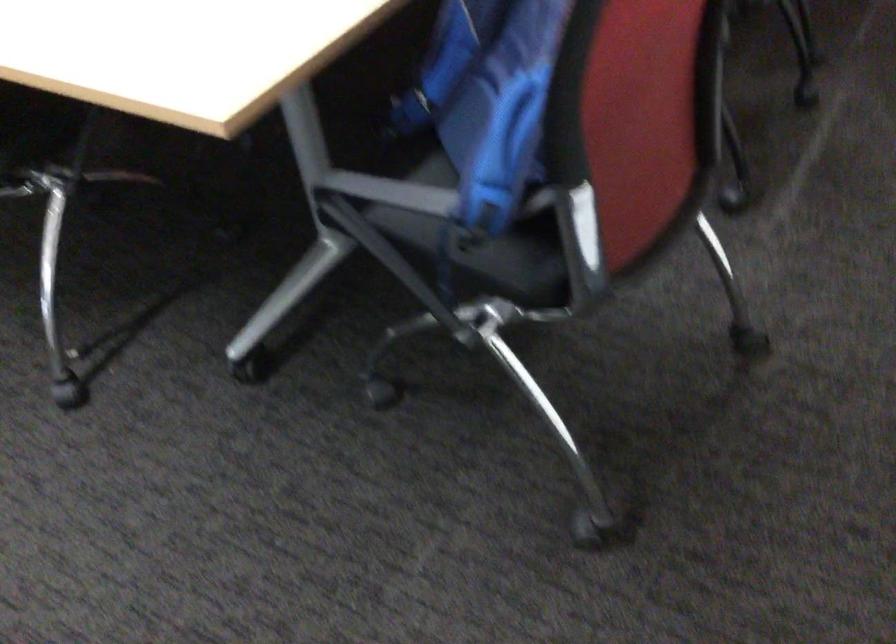
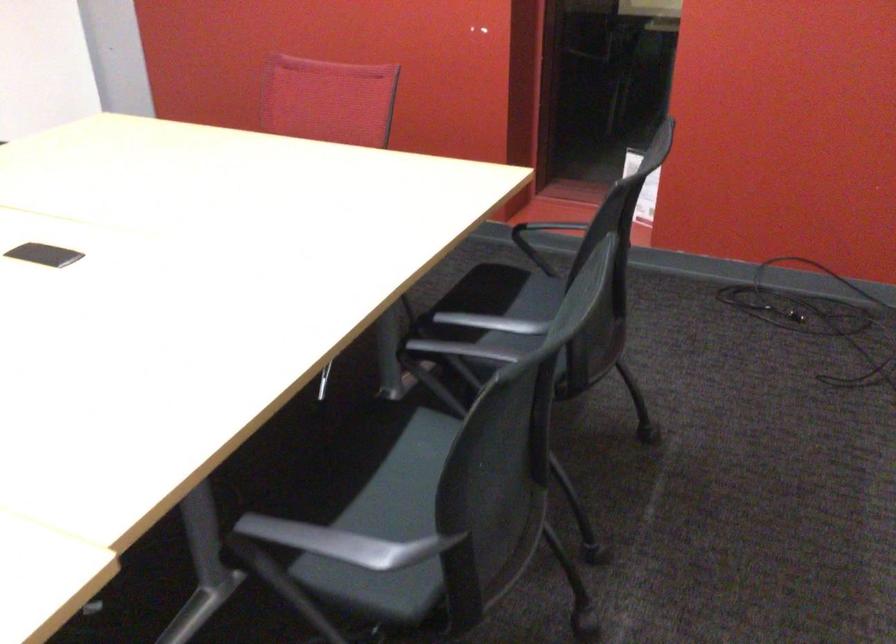
What movement of the cameraman would produce the second image?

The movement direction of the cameraman is right, forward.